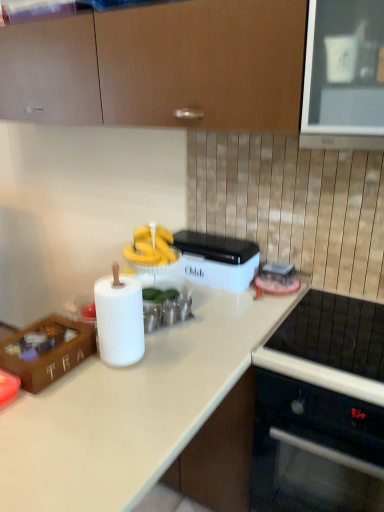
Identify the location of vacant space to the right of wooden tea box at lower left. (117, 375).